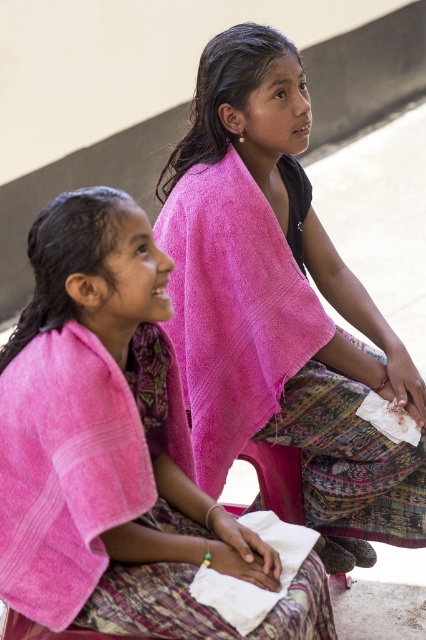
Question: Based on their relative distances, which object is nearer to the pink fabric at center?

Choices:
 (A) pink towel at upper center
 (B) pink towel at left

Answer: (A)

Question: Does pink fabric at center have a smaller size compared to pink towel at left?

Choices:
 (A) yes
 (B) no

Answer: (B)

Question: Does pink fabric at center lie in front of pink towel at left?

Choices:
 (A) no
 (B) yes

Answer: (A)

Question: Does pink fabric at center appear over pink towel at upper center?

Choices:
 (A) no
 (B) yes

Answer: (B)

Question: Which is farther from the pink towel at left?

Choices:
 (A) pink towel at upper center
 (B) pink fabric at center

Answer: (B)

Question: Which point is closer to the camera taking this photo?

Choices:
 (A) (189, 259)
 (B) (239, 170)
 (C) (117, 237)

Answer: (C)